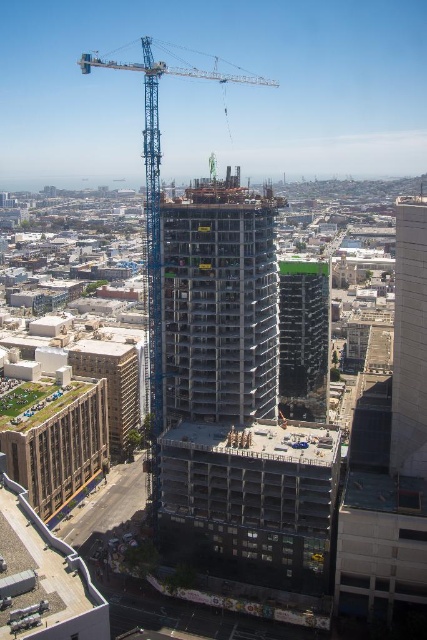
You are a construction worker standing at the edge of the construction site. You need to move a heavy beam from the ground to the upper floor of the concrete building at center. The blue metallic crane at center is available. Can you use the crane to lift the beam to the building?

The concrete building at center is closer to you than the blue metallic crane at center. Since the crane is further away, its arm might not reach the building. Therefore, you might not be able to use the crane to lift the beam to the building.

You are a construction worker standing at the point labeled point (219, 304). You need to move towards the blue construction crane on the left. Which direction should you walk?

The blue construction crane is on the left side of the image, so to move towards it from the point labeled point (219, 304), you should walk to the left.

Looking at this image, you are a drone operator tasked with capturing aerial footage of the construction site. Your drone has a maximum flight range of 100 meters. Based on the scene, can your drone safely fly to the concrete building at center to capture footage without exceeding its range?

The concrete building at center is 106.42 meters away from camera. Since the drone has a maximum range of 100 meters, it cannot safely reach the building without exceeding its operational limits. You should consider a drone with a longer range or adjust your position closer to the site.